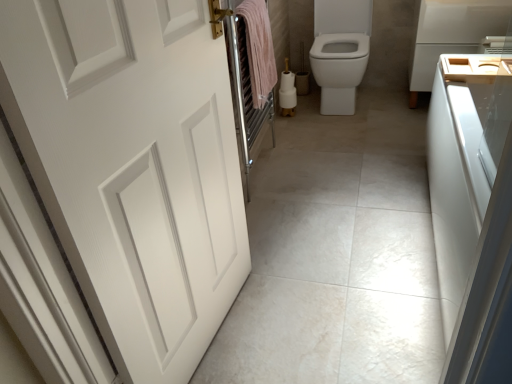
Question: Can you see white matte door at left touching white glossy bidet at center?

Choices:
 (A) no
 (B) yes

Answer: (A)

Question: Considering the relative sizes of white matte door at left and white glossy bidet at center in the image provided, is white matte door at left wider than white glossy bidet at center?

Choices:
 (A) yes
 (B) no

Answer: (B)

Question: Does white matte door at left have a lesser height compared to white glossy bidet at center?

Choices:
 (A) yes
 (B) no

Answer: (B)

Question: Is white glossy bidet at center at the back of white matte door at left?

Choices:
 (A) yes
 (B) no

Answer: (B)

Question: Could you tell me if white matte door at left is turned towards white glossy bidet at center?

Choices:
 (A) yes
 (B) no

Answer: (B)

Question: From the image's perspective, relative to white glossy bidet at center, is pink cotton towel at center above or below?

Choices:
 (A) above
 (B) below

Answer: (B)

Question: Looking at the image, does pink cotton towel at center seem bigger or smaller compared to white glossy bidet at center?

Choices:
 (A) big
 (B) small

Answer: (B)

Question: From a real-world perspective, relative to white glossy bidet at center, is pink cotton towel at center vertically above or below?

Choices:
 (A) below
 (B) above

Answer: (B)

Question: Considering their positions, is pink cotton towel at center located in front of or behind white glossy bidet at center?

Choices:
 (A) front
 (B) behind

Answer: (A)

Question: Is pink cotton towel at center bigger or smaller than white matte door at left?

Choices:
 (A) small
 (B) big

Answer: (A)

Question: From a real-world perspective, is pink cotton towel at center positioned above or below white matte door at left?

Choices:
 (A) above
 (B) below

Answer: (A)

Question: Considering the positions of point (246, 16) and point (192, 132), is point (246, 16) closer or farther from the camera than point (192, 132)?

Choices:
 (A) closer
 (B) farther

Answer: (B)

Question: Considering the positions of pink cotton towel at center and white matte door at left in the image, is pink cotton towel at center taller or shorter than white matte door at left?

Choices:
 (A) tall
 (B) short

Answer: (B)

Question: Considering the positions of wooden tray at right and wooden sink at right in the image, is wooden tray at right taller or shorter than wooden sink at right?

Choices:
 (A) short
 (B) tall

Answer: (B)

Question: From a real-world perspective, is wooden tray at right above or below wooden sink at right?

Choices:
 (A) above
 (B) below

Answer: (B)